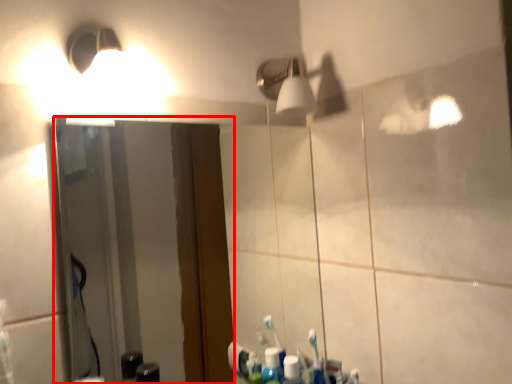
Question: From the image's perspective, what is the correct spatial relationship of mirror (annotated by the red box) in relation to light fixture?

Choices:
 (A) above
 (B) below

Answer: (B)